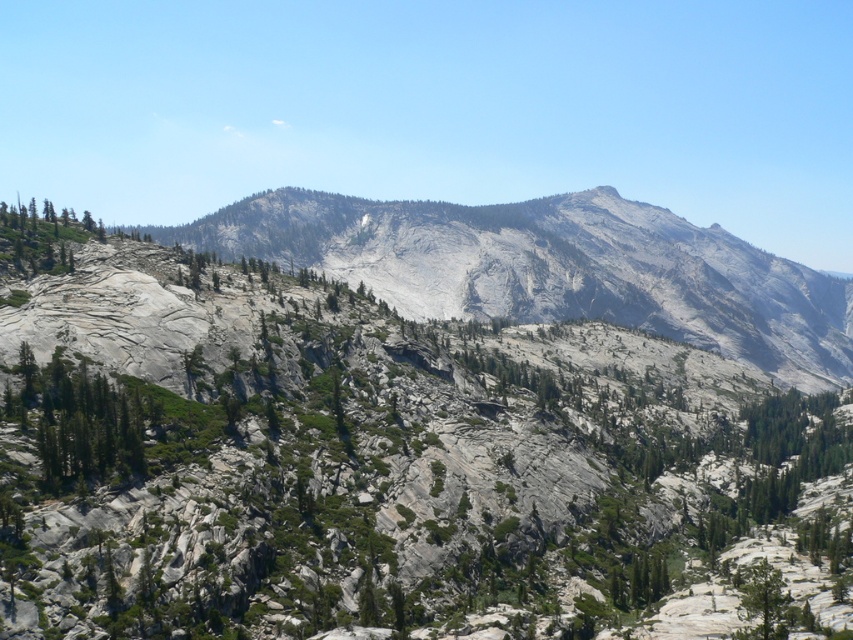
Question: Which object appears closest to the camera in this image?

Choices:
 (A) green leafy tree at lower left
 (B) gray/rocky mountain at center

Answer: (A)

Question: Estimate the real-world distances between objects in this image. Which object is farther from the green leafy tree at lower left?

Choices:
 (A) gray/rocky mountain at center
 (B) green leafy tree at lower right

Answer: (A)

Question: Which object is the farthest from the gray/rocky mountain at center?

Choices:
 (A) green leafy tree at lower left
 (B) green leafy tree at lower right

Answer: (B)

Question: Does gray/rocky mountain at center appear on the right side of green leafy tree at lower right?

Choices:
 (A) yes
 (B) no

Answer: (A)

Question: Is green leafy tree at lower left positioned before green leafy tree at lower right?

Choices:
 (A) yes
 (B) no

Answer: (B)

Question: Is green leafy tree at lower left wider than green leafy tree at lower right?

Choices:
 (A) yes
 (B) no

Answer: (A)